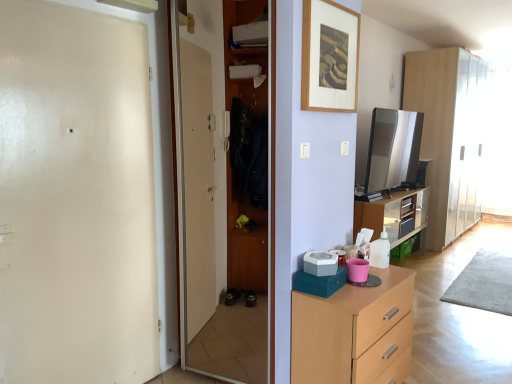
Question: Is light wood cupboard at right closer to camera compared to wooden wardrobe at center, which is counted as the first screen door, starting from the right?

Choices:
 (A) no
 (B) yes

Answer: (A)

Question: Does light wood cupboard at right have a larger size compared to wooden wardrobe at center, acting as the 2th screen door starting from the left?

Choices:
 (A) yes
 (B) no

Answer: (A)

Question: Can you confirm if light wood cupboard at right is smaller than wooden wardrobe at center, acting as the 2th screen door starting from the left?

Choices:
 (A) yes
 (B) no

Answer: (B)

Question: Is light wood cupboard at right behind wooden wardrobe at center, which is counted as the first screen door, starting from the right?

Choices:
 (A) no
 (B) yes

Answer: (B)

Question: Are light wood cupboard at right and wooden wardrobe at center, which is counted as the first screen door, starting from the right, far apart?

Choices:
 (A) no
 (B) yes

Answer: (B)

Question: Is wooden wardrobe at center, which is counted as the first screen door, starting from the right, inside light wood cupboard at right?

Choices:
 (A) no
 (B) yes

Answer: (A)

Question: Considering the relative sizes of white plastic pet feeder at center, positioned as the 1th appliance in bottom-to-top order, and white glossy door at left, the 2th screen door positioned from the right, in the image provided, is white plastic pet feeder at center, positioned as the 1th appliance in bottom-to-top order, thinner than white glossy door at left, the 2th screen door positioned from the right,?

Choices:
 (A) yes
 (B) no

Answer: (B)

Question: Does white plastic pet feeder at center, which is the second appliance from top to bottom, turn towards white glossy door at left, the 2th screen door positioned from the right?

Choices:
 (A) no
 (B) yes

Answer: (A)

Question: Is white glossy door at left, which is counted as the 1th screen door, starting from the left, inside white plastic pet feeder at center, which is the second appliance from top to bottom?

Choices:
 (A) no
 (B) yes

Answer: (A)

Question: From a real-world perspective, is white plastic pet feeder at center, arranged as the second appliance when viewed from the right, positioned over white glossy door at left, the 2th screen door positioned from the right, based on gravity?

Choices:
 (A) yes
 (B) no

Answer: (B)

Question: Can you confirm if white plastic pet feeder at center, which appears as the 1th appliance when viewed from the left, is taller than white glossy door at left, the 2th screen door positioned from the right?

Choices:
 (A) no
 (B) yes

Answer: (A)

Question: Considering the relative sizes of white plastic pet feeder at center, arranged as the second appliance when viewed from the right, and white glossy door at left, which is counted as the 1th screen door, starting from the left, in the image provided, is white plastic pet feeder at center, arranged as the second appliance when viewed from the right, smaller than white glossy door at left, which is counted as the 1th screen door, starting from the left,?

Choices:
 (A) no
 (B) yes

Answer: (B)

Question: Is light wood chest of drawers at lower right aimed at wooden picture frame at upper center?

Choices:
 (A) yes
 (B) no

Answer: (B)